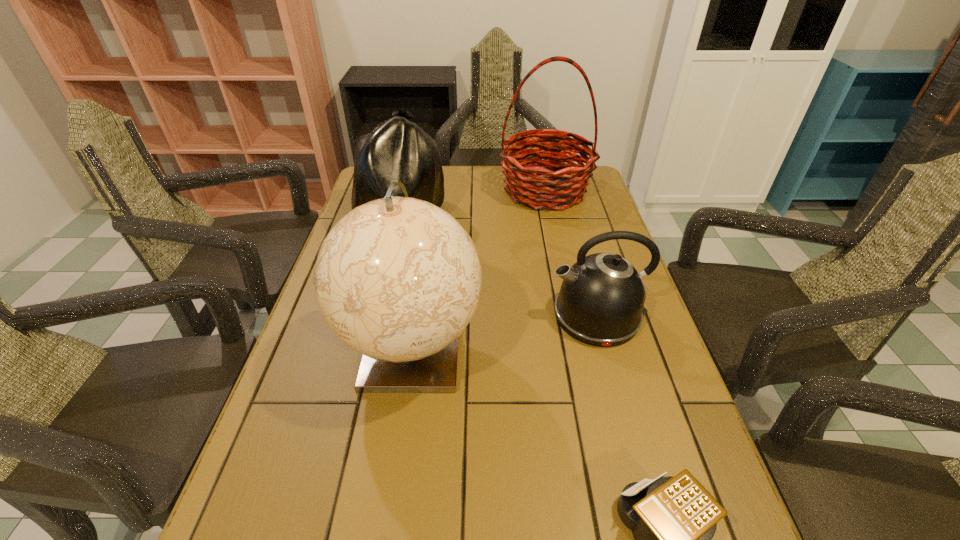
The height and width of the screenshot is (540, 960). Identify the location of basket situated at the far edge. (530, 185).

Locate an element on the screen. The height and width of the screenshot is (540, 960). plastic bag positioned at the far edge is located at coordinates pos(398,150).

Locate an element on the screen. This screenshot has height=540, width=960. globe that is at the left edge is located at coordinates (397, 279).

Locate an element on the screen. The height and width of the screenshot is (540, 960). plastic bag located at the left edge is located at coordinates (398, 150).

This screenshot has width=960, height=540. Find the location of `basket that is positioned at the right edge`. basket that is positioned at the right edge is located at coordinates (530, 185).

Find the location of a particular element. kettle that is at the right edge is located at coordinates pos(601,299).

Find the location of `object that is positioned at the far left corner`. object that is positioned at the far left corner is located at coordinates (398, 150).

Locate an element on the screen. The width and height of the screenshot is (960, 540). object at the far right corner is located at coordinates (530, 185).

Where is `vacant area at the far edge of the desktop`? Image resolution: width=960 pixels, height=540 pixels. vacant area at the far edge of the desktop is located at coordinates (504, 168).

Image resolution: width=960 pixels, height=540 pixels. In the image, there is a desktop. In order to click on free space at the left edge in this screenshot , I will do `click(325, 359)`.